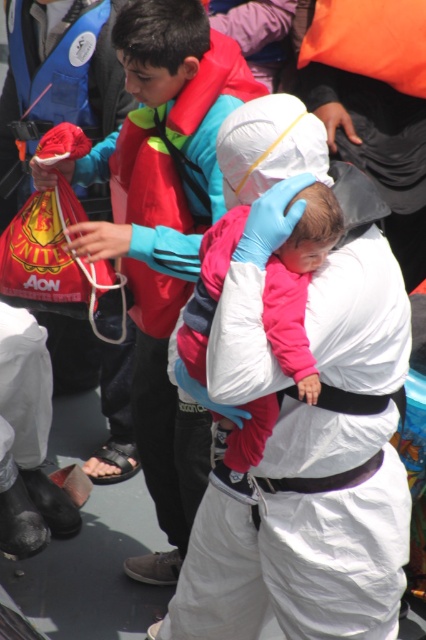
Where is `red nylon life jacket at upper center`? The image size is (426, 640). red nylon life jacket at upper center is located at coordinates (175, 145).

Based on the photo, between red nylon life jacket at upper center and pink fleece jacket at center, which one is positioned lower?

pink fleece jacket at center

You are a GUI agent. You are given a task and a screenshot of the screen. Output one action in this format:
    pyautogui.click(x=<x>, y=<y>)
    Task: Click on the red nylon life jacket at upper center
    Image resolution: width=426 pixels, height=640 pixels.
    Given the screenshot: What is the action you would take?
    pyautogui.click(x=175, y=145)